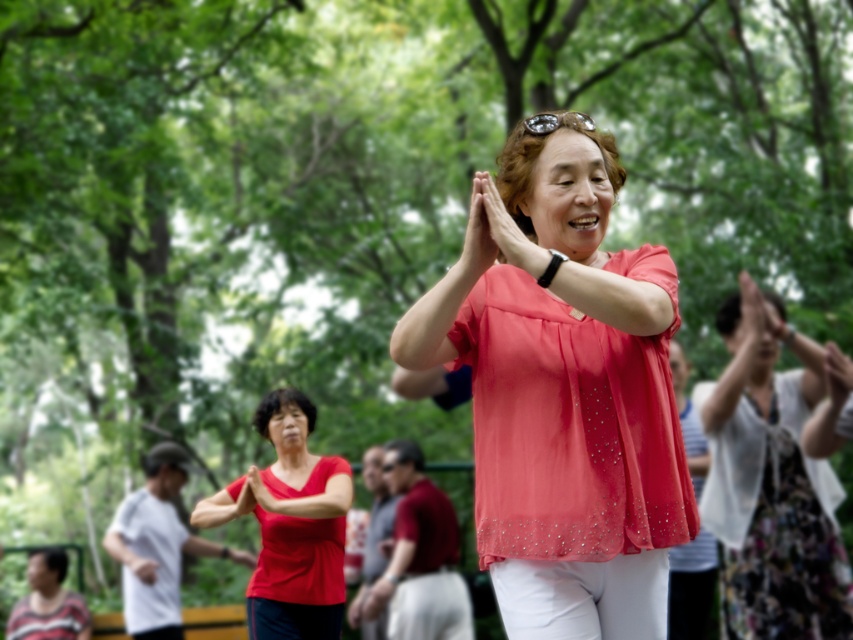
Question: Does floral dress at center have a greater width compared to matte red blouse at center?

Choices:
 (A) yes
 (B) no

Answer: (A)

Question: Which point is farther from the camera taking this photo?

Choices:
 (A) (757, 493)
 (B) (573, 573)

Answer: (A)

Question: Which object is positioned closest to the matte pink blouse at center?

Choices:
 (A) floral dress at center
 (B) matte red blouse at center

Answer: (B)

Question: Which of the following is the closest to the observer?

Choices:
 (A) (581, 440)
 (B) (724, 452)
 (C) (329, 502)

Answer: (A)

Question: Where is matte pink blouse at center located in relation to floral dress at center in the image?

Choices:
 (A) above
 (B) below

Answer: (A)

Question: In this image, where is floral dress at center located relative to matte red blouse at center?

Choices:
 (A) right
 (B) left

Answer: (A)